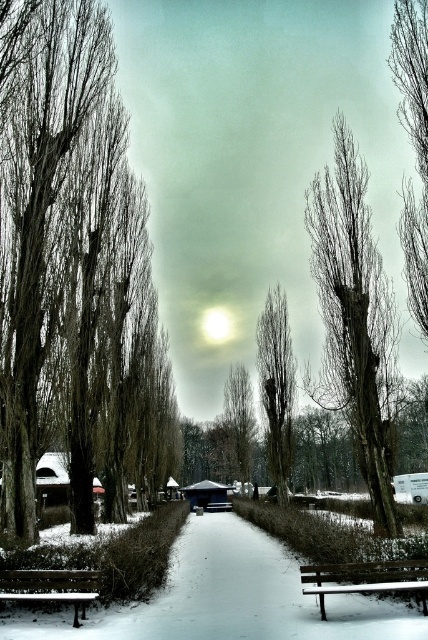
Can you confirm if snow-covered wood bench at lower right is positioned above wooden bench at lower left?

Correct, snow-covered wood bench at lower right is located above wooden bench at lower left.

Who is higher up, snow-covered wood bench at lower right or wooden bench at lower left?

snow-covered wood bench at lower right is higher up.

Locate an element on the screen. This screenshot has width=428, height=640. snow-covered wood bench at lower right is located at coordinates (365, 579).

In order to click on snow-covered wood bench at lower right in this screenshot , I will do `click(365, 579)`.

Does bare wood tree at center have a lesser width compared to snow-covered wood bench at lower right?

In fact, bare wood tree at center might be wider than snow-covered wood bench at lower right.

Is bare wood tree at center to the right of snow-covered wood bench at lower right from the viewer's perspective?

Yes, bare wood tree at center is to the right of snow-covered wood bench at lower right.

Identify the location of bare wood tree at center. (353, 317).

Where is `bare wood tree at center`? This screenshot has width=428, height=640. bare wood tree at center is located at coordinates (353, 317).

Does smooth bark tree at center have a smaller size compared to snow-covered wood bench at lower right?

No, smooth bark tree at center is not smaller than snow-covered wood bench at lower right.

Can you confirm if smooth bark tree at center is taller than snow-covered wood bench at lower right?

Correct, smooth bark tree at center is much taller as snow-covered wood bench at lower right.

The width and height of the screenshot is (428, 640). In order to click on smooth bark tree at center in this screenshot , I will do `click(276, 387)`.